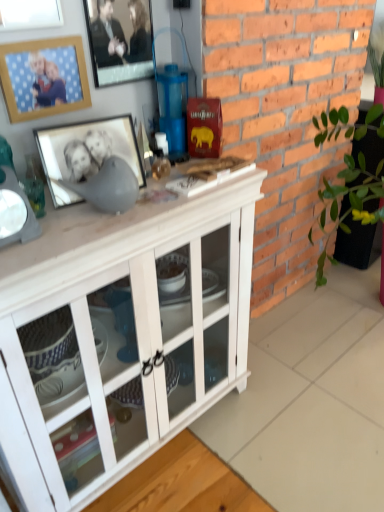
Question: Is the position of wooden picture frame at upper left, the second picture frame from the bottom, less distant than that of white wood cabinet at center?

Choices:
 (A) no
 (B) yes

Answer: (A)

Question: Does wooden picture frame at upper left, the second picture frame from the bottom, turn towards white wood cabinet at center?

Choices:
 (A) no
 (B) yes

Answer: (A)

Question: From a real-world perspective, is wooden picture frame at upper left, the second picture frame from the bottom, on top of white wood cabinet at center?

Choices:
 (A) yes
 (B) no

Answer: (A)

Question: Is wooden picture frame at upper left, arranged as the 2th picture frame when viewed from the top, far away from white wood cabinet at center?

Choices:
 (A) no
 (B) yes

Answer: (A)

Question: Is wooden picture frame at upper left, arranged as the 2th picture frame when viewed from the top, to the right of white wood cabinet at center from the viewer's perspective?

Choices:
 (A) no
 (B) yes

Answer: (A)

Question: Is brick at right wider or thinner than wooden picture frame at upper left, the second picture frame from the bottom?

Choices:
 (A) thin
 (B) wide

Answer: (B)

Question: From a real-world perspective, is brick at right above or below wooden picture frame at upper left, arranged as the 2th picture frame when viewed from the top?

Choices:
 (A) above
 (B) below

Answer: (B)

Question: In the image, is brick at right positioned in front of or behind wooden picture frame at upper left, arranged as the 2th picture frame when viewed from the top?

Choices:
 (A) behind
 (B) front

Answer: (A)

Question: Is brick at right inside the boundaries of wooden picture frame at upper left, arranged as the 2th picture frame when viewed from the top, or outside?

Choices:
 (A) inside
 (B) outside

Answer: (B)

Question: Does point (223, 259) appear closer or farther from the camera than point (77, 59)?

Choices:
 (A) closer
 (B) farther

Answer: (B)

Question: Considering their positions, is white wood cabinet at center located in front of or behind wooden picture frame at upper left, arranged as the 2th picture frame when viewed from the top?

Choices:
 (A) front
 (B) behind

Answer: (A)

Question: Based on their positions, is white wood cabinet at center located to the left or right of wooden picture frame at upper left, arranged as the 2th picture frame when viewed from the top?

Choices:
 (A) right
 (B) left

Answer: (A)

Question: Looking at their shapes, would you say white wood cabinet at center is wider or thinner than wooden picture frame at upper left, the second picture frame from the bottom?

Choices:
 (A) thin
 (B) wide

Answer: (B)

Question: From the image's perspective, relative to brick at right, is metallic silver picture frame at upper center, arranged as the third picture frame when ordered from the bottom, above or below?

Choices:
 (A) below
 (B) above

Answer: (B)

Question: Relative to brick at right, is metallic silver picture frame at upper center, acting as the 1th picture frame starting from the top, in front or behind?

Choices:
 (A) behind
 (B) front

Answer: (A)